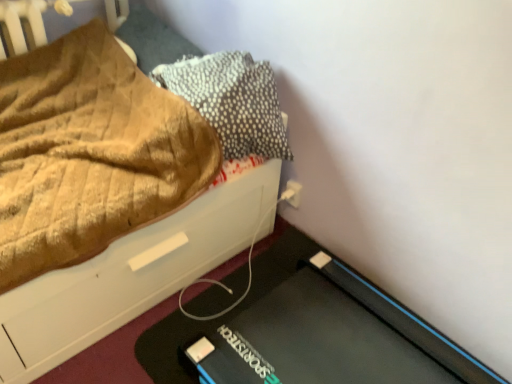
Question: Considering the relative sizes of textured gray pillow at upper right, which is the second pillow from left to right, and brown textured pillow at upper left, positioned as the 1th pillow in left-to-right order, in the image provided, is textured gray pillow at upper right, which is the second pillow from left to right, smaller than brown textured pillow at upper left, positioned as the 1th pillow in left-to-right order,?

Choices:
 (A) yes
 (B) no

Answer: (B)

Question: Is the depth of textured gray pillow at upper right, acting as the first pillow starting from the right, less than that of brown textured pillow at upper left, positioned as the 1th pillow in left-to-right order?

Choices:
 (A) yes
 (B) no

Answer: (A)

Question: Is textured gray pillow at upper right, which is the second pillow from left to right, further to camera compared to brown textured pillow at upper left, placed as the 2th pillow when sorted from right to left?

Choices:
 (A) no
 (B) yes

Answer: (A)

Question: Considering the relative sizes of textured gray pillow at upper right, which is the second pillow from left to right, and brown textured pillow at upper left, positioned as the 1th pillow in left-to-right order, in the image provided, is textured gray pillow at upper right, which is the second pillow from left to right, taller than brown textured pillow at upper left, positioned as the 1th pillow in left-to-right order,?

Choices:
 (A) yes
 (B) no

Answer: (A)

Question: Is textured gray pillow at upper right, acting as the first pillow starting from the right, thinner than brown textured pillow at upper left, placed as the 2th pillow when sorted from right to left?

Choices:
 (A) no
 (B) yes

Answer: (A)

Question: Considering the positions of brown textured pillow at upper left, placed as the 2th pillow when sorted from right to left, and textured gray pillow at upper right, acting as the first pillow starting from the right, in the image, is brown textured pillow at upper left, placed as the 2th pillow when sorted from right to left, bigger or smaller than textured gray pillow at upper right, acting as the first pillow starting from the right,?

Choices:
 (A) small
 (B) big

Answer: (A)

Question: From the image's perspective, relative to textured gray pillow at upper right, acting as the first pillow starting from the right, is brown textured pillow at upper left, placed as the 2th pillow when sorted from right to left, above or below?

Choices:
 (A) above
 (B) below

Answer: (A)

Question: Does point (136, 31) appear closer or farther from the camera than point (175, 66)?

Choices:
 (A) closer
 (B) farther

Answer: (B)

Question: Is brown textured pillow at upper left, placed as the 2th pillow when sorted from right to left, spatially inside textured gray pillow at upper right, which is the second pillow from left to right, or outside of it?

Choices:
 (A) inside
 (B) outside

Answer: (B)

Question: Considering the positions of white plastic electric outlet at lower right and brown textured fabric at upper left in the image, is white plastic electric outlet at lower right taller or shorter than brown textured fabric at upper left?

Choices:
 (A) tall
 (B) short

Answer: (B)

Question: From a real-world perspective, is white plastic electric outlet at lower right above or below brown textured fabric at upper left?

Choices:
 (A) below
 (B) above

Answer: (A)

Question: Based on their positions, is white plastic electric outlet at lower right located to the left or right of brown textured fabric at upper left?

Choices:
 (A) right
 (B) left

Answer: (A)

Question: Considering the positions of white plastic electric outlet at lower right and brown textured fabric at upper left in the image, is white plastic electric outlet at lower right bigger or smaller than brown textured fabric at upper left?

Choices:
 (A) small
 (B) big

Answer: (A)

Question: In terms of size, does brown textured pillow at upper left, placed as the 2th pillow when sorted from right to left, appear bigger or smaller than white plastic electric outlet at lower right?

Choices:
 (A) big
 (B) small

Answer: (A)

Question: From their relative heights in the image, would you say brown textured pillow at upper left, placed as the 2th pillow when sorted from right to left, is taller or shorter than white plastic electric outlet at lower right?

Choices:
 (A) tall
 (B) short

Answer: (A)